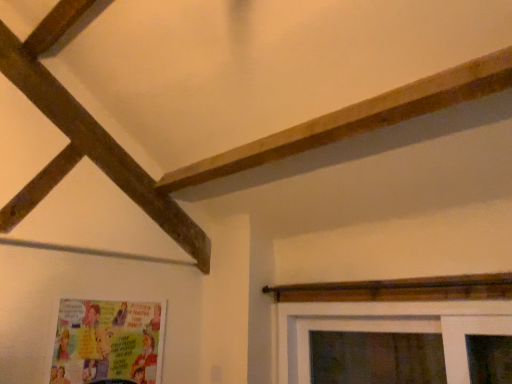
Describe the element at coordinates (108, 342) in the screenshot. I see `colorful paper poster at lower left` at that location.

What is the approximate width of colorful paper poster at lower left?

colorful paper poster at lower left is 1.55 inches in width.

This screenshot has height=384, width=512. Find the location of `colorful paper poster at lower left`. colorful paper poster at lower left is located at coordinates (108, 342).

At what (x,y) coordinates should I click in order to perform the action: click on colorful paper poster at lower left. Please return your answer as a coordinate pair (x, y). Looking at the image, I should click on (108, 342).